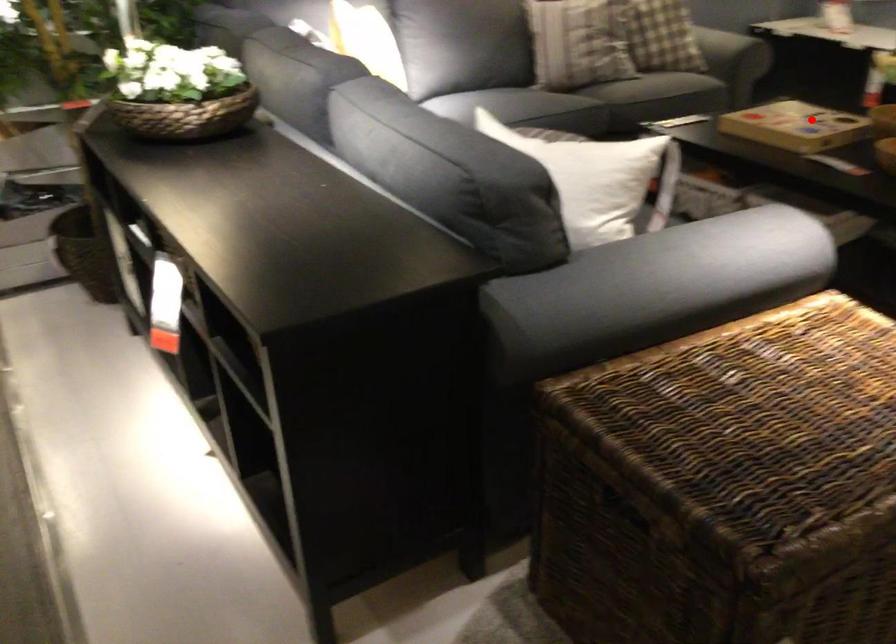
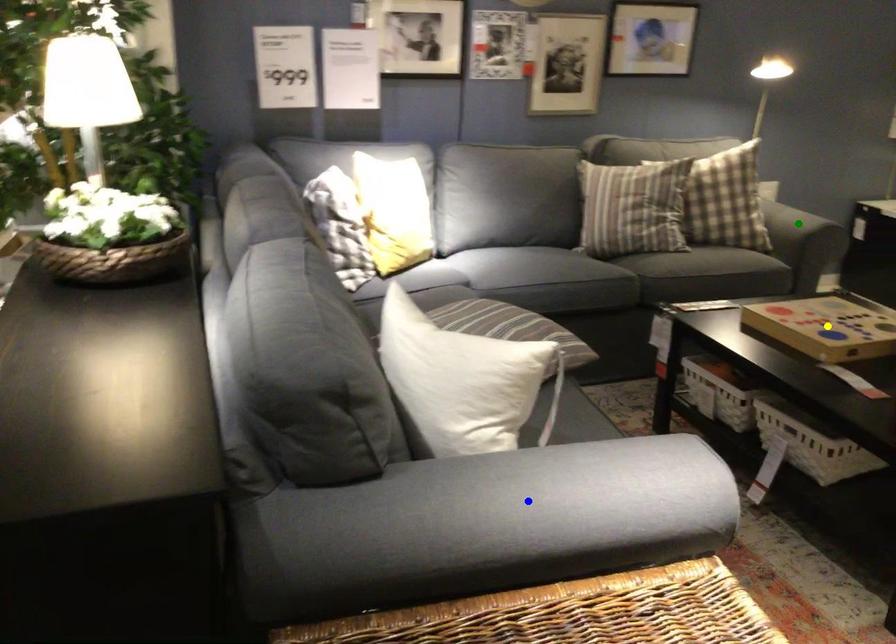
Question: I am providing you with two images of the same scene from different viewpoints. A red point is marked on the first image. You are given multiple points on the second image. Can you choose the point in image 2 that corresponds to the point in image 1?

Choices:
 (A) green point
 (B) blue point
 (C) yellow point

Answer: (C)